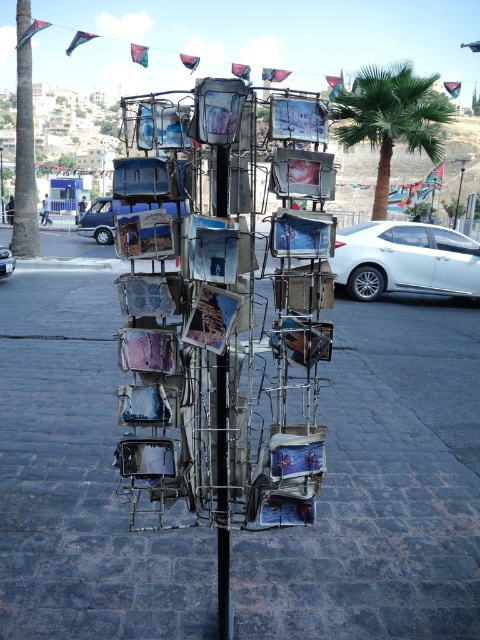
Question: Which object is the closest to the green leafy palm tree at center?

Choices:
 (A) silver metallic car at center
 (B) white metallic sedan at right
 (C) metallic wire rack at center
 (D) metallic photo frames at center

Answer: (B)

Question: Among these points, which one is nearest to the camera?

Choices:
 (A) (117, 380)
 (B) (391, 288)
 (C) (79, 228)
 (D) (86, 204)

Answer: (A)

Question: Estimate the real-world distances between objects in this image. Which object is closer to the white metallic sedan at right?

Choices:
 (A) matte silver van at left
 (B) metallic photo frames at center
 (C) metallic gray pavement at center
 (D) silver metallic car at center

Answer: (C)

Question: Does green leafy palm tree at center have a lesser width compared to metallic wire rack at center?

Choices:
 (A) no
 (B) yes

Answer: (A)

Question: Does green leafy palm tree at center appear over metallic wire rack at center?

Choices:
 (A) yes
 (B) no

Answer: (A)

Question: Does silver metallic car at center have a smaller size compared to metallic wire rack at center?

Choices:
 (A) no
 (B) yes

Answer: (A)